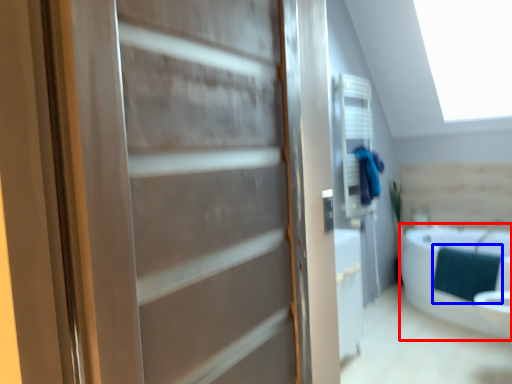
Question: Which point is closer to the camera, bathtub (highlighted by a red box) or blanket (highlighted by a blue box)?

Choices:
 (A) bathtub
 (B) blanket

Answer: (A)